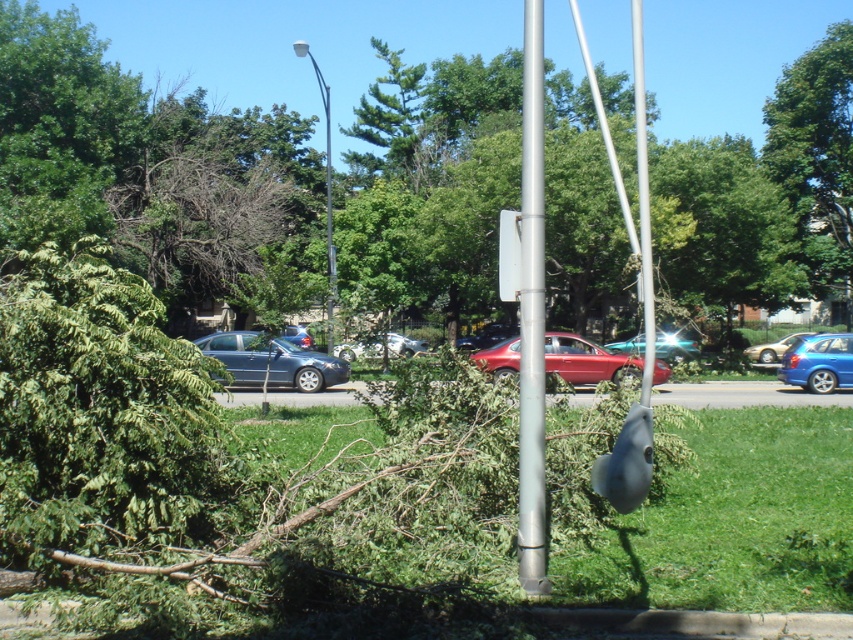
You are standing at the edge of the park and see the silver metallic flag pole at center and the white glossy streetlight at upper center. Which object is closer to you?

The silver metallic flag pole at center is closer to you because it is positioned over the white glossy streetlight at upper center, indicating it is in front.

You are standing in the park and see the silver metallic pole at center and the silver metallic flag pole at center. Which one is positioned to the left?

The silver metallic pole at center is positioned to the left of the silver metallic flag pole at center.

You are a maintenance worker in the park. You need to check both the silver metallic pole at center and the silver metallic flag pole at center. Which one should you check first if you want to start from the lower part of the structure?

You should check the silver metallic pole at center first because it is positioned under the silver metallic flag pole at center, making it the lower structure.